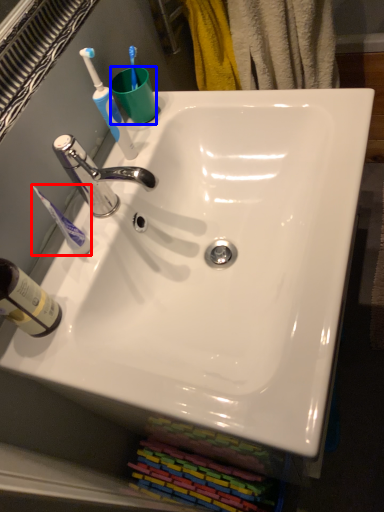
Question: Which of the following is the farthest to the observer, toothbrush (highlighted by a red box) or coffee cup (highlighted by a blue box)?

Choices:
 (A) toothbrush
 (B) coffee cup

Answer: (B)